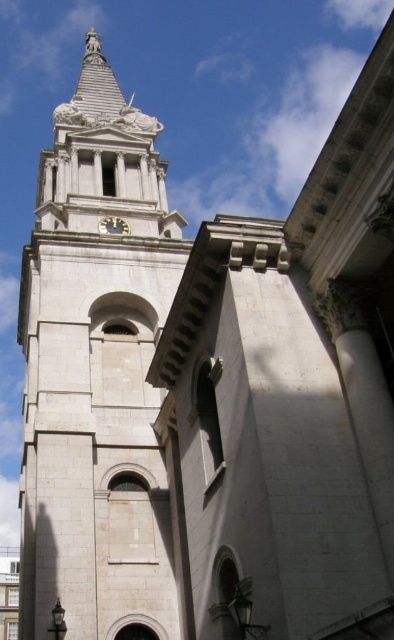
Is white stone clock tower at center wider than black glossy clock at upper center?

Yes, white stone clock tower at center is wider than black glossy clock at upper center.

Between white stone clock tower at center and black glossy clock at upper center, which one is positioned higher?

white stone clock tower at center

Who is more forward, (128, 278) or (111, 228)?

Point (128, 278) is more forward.

Find the location of a particular element. white stone clock tower at center is located at coordinates (96, 371).